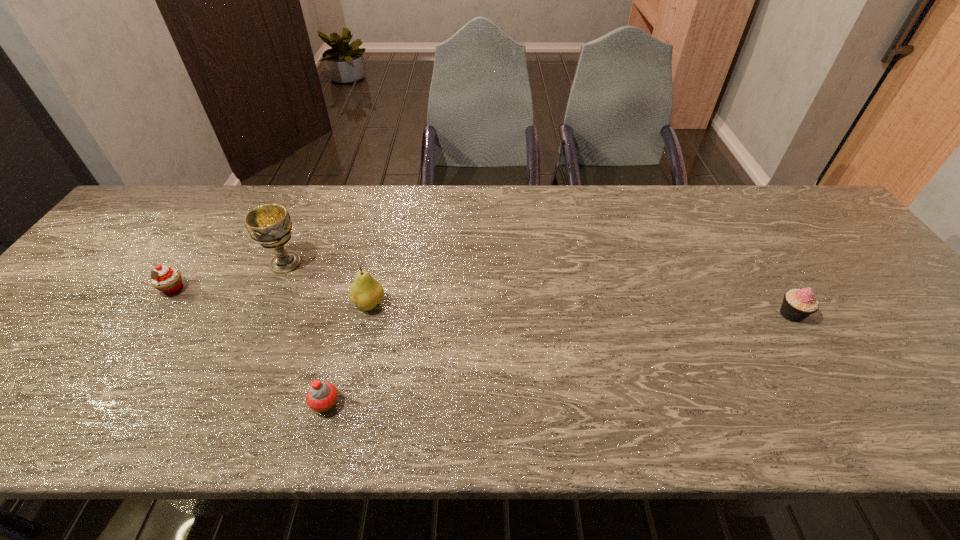
The image size is (960, 540). I want to click on chalice, so click(269, 225).

Find the location of a particular element. Image resolution: width=960 pixels, height=540 pixels. the farthest object is located at coordinates (269, 225).

Locate an element on the screen. The width and height of the screenshot is (960, 540). the second tallest object is located at coordinates (366, 292).

Find the location of a particular element. the rightmost cupcake is located at coordinates (798, 304).

Image resolution: width=960 pixels, height=540 pixels. I want to click on the second nearest cupcake, so click(x=798, y=304).

This screenshot has height=540, width=960. Identify the location of the farthest cupcake. (168, 280).

Identify the location of the leftmost object. The width and height of the screenshot is (960, 540). (168, 280).

What are the coordinates of `the nearest object` in the screenshot? It's located at (322, 396).

Image resolution: width=960 pixels, height=540 pixels. I want to click on the second cupcake from left to right, so click(322, 396).

Identify the location of vacant space located 0.270m on the right of the fourth object from right to left. (405, 263).